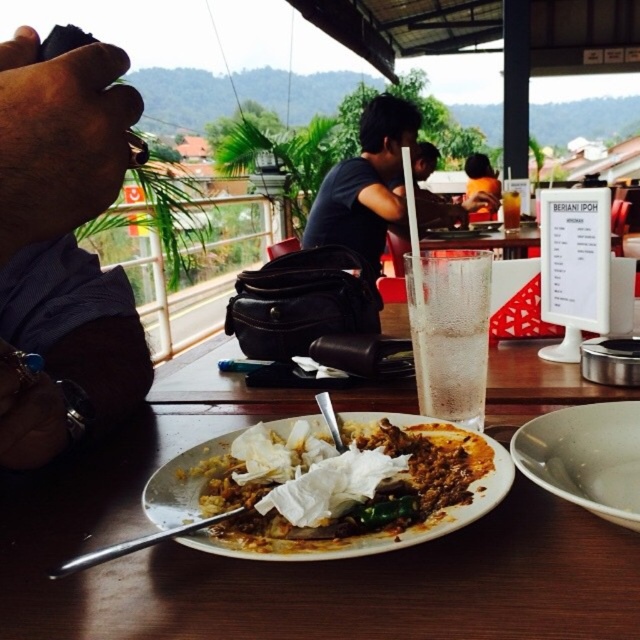
You are a waiter at this outdoor restaurant and need to place a new order for a customer. The order includes a hot beverage that requires a cup. You have a choice between a cup that is 1 foot in diameter and another that is 1.5 feet in diameter. Considering the space between the clear glass at center and the matte black bag at center, which cup size would you choose to ensure it fits without moving either object?

The clear glass at center and matte black bag at center are 13.43 feet apart. Since the distance between them is much larger than both cup sizes, either the 1 foot or 1.5 foot diameter cup would fit comfortably between them without needing to move either object.

Consider the image. You are a waiter at this outdoor restaurant and need to place a new order on the table. The new order includes a large platter that requires space. Looking at the table, which object between the matte black bag at center and the clear glass beverage at center should you move to make more space?

The matte black bag at center is bigger than the clear glass beverage at center, so moving the matte black bag at center would free up more space for the large platter.

You are a server at the outdoor restaurant. You need to place a new menu on the table without covering any existing items. Considering the dark skin tone hand at left and the clear glass at center, which object requires more space to the right to avoid overlapping?

The dark skin tone hand at left requires more space to the right because its width is larger than the clear glass at center.